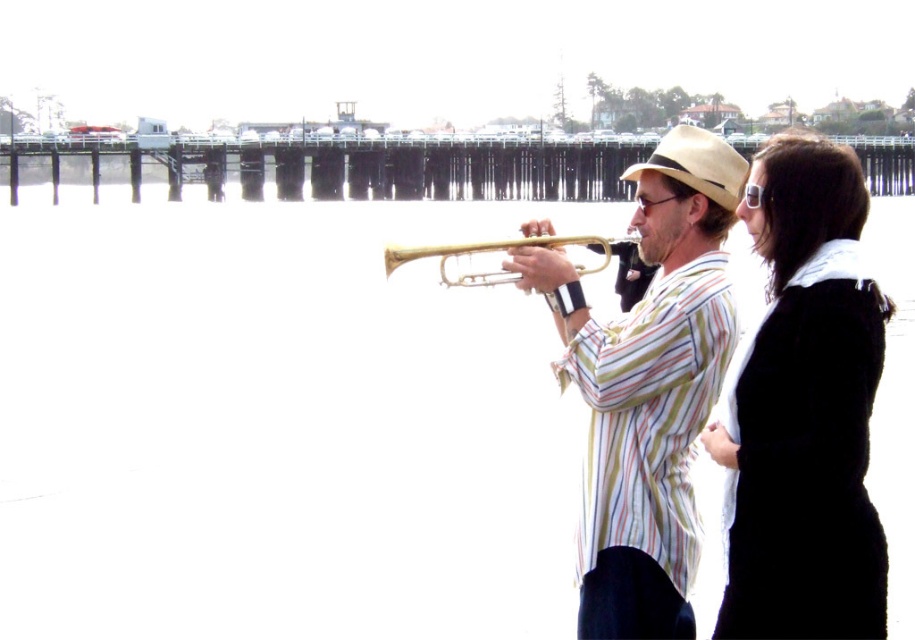
Question: Which of these objects is positioned farthest from the gold shiny trumpet at center?

Choices:
 (A) beige felt cowboy hat at center
 (B) gold brass trumpet at center
 (C) wooden pier at center

Answer: (C)

Question: Is wooden pier at center below gold brass trumpet at center?

Choices:
 (A) yes
 (B) no

Answer: (B)

Question: Which object appears closest to the camera in this image?

Choices:
 (A) wooden pier at center
 (B) gold shiny trumpet at center

Answer: (B)

Question: Can you confirm if wooden pier at center is thinner than beige felt cowboy hat at center?

Choices:
 (A) yes
 (B) no

Answer: (B)

Question: Which object appears farthest from the camera in this image?

Choices:
 (A) wooden pier at center
 (B) gold shiny trumpet at center

Answer: (A)

Question: Can you confirm if beige felt cowboy hat at center is positioned to the left of gold brass trumpet at center?

Choices:
 (A) yes
 (B) no

Answer: (B)